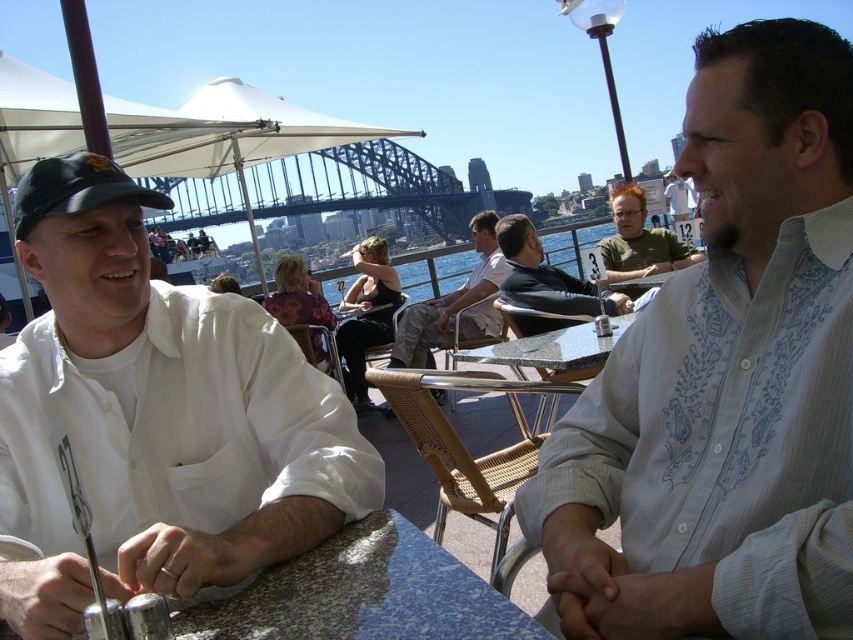
Question: Is camouflage pants at center to the right of granite table at center from the viewer's perspective?

Choices:
 (A) no
 (B) yes

Answer: (A)

Question: Which of these objects is positioned closest to the dark gray shirt at center?

Choices:
 (A) green t-shirt at center
 (B) light blue shirt at center

Answer: (A)

Question: Is dark gray shirt at center smaller than green t-shirt at center?

Choices:
 (A) no
 (B) yes

Answer: (B)

Question: Estimate the real-world distances between objects in this image. Which object is farther from the green t-shirt at center?

Choices:
 (A) white matte shirt at left
 (B) camouflage pants at center

Answer: (A)

Question: Is white embroidered shirt at center thinner than light blue shirt at center?

Choices:
 (A) yes
 (B) no

Answer: (A)

Question: Which object is the farthest from the camouflage pants at center?

Choices:
 (A) dark gray shirt at center
 (B) white embroidered shirt at center

Answer: (B)